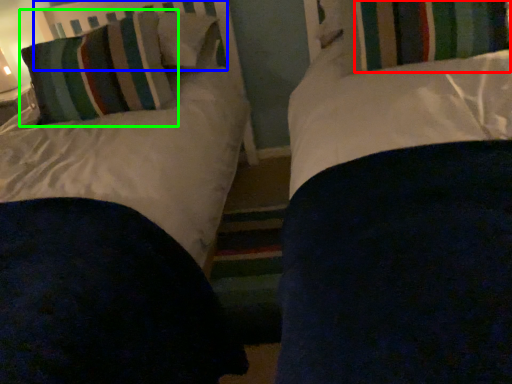
Question: Which is nearer to the curtain (highlighted by a red box)? headboard (highlighted by a blue box) or pillow (highlighted by a green box).

Choices:
 (A) headboard
 (B) pillow

Answer: (B)